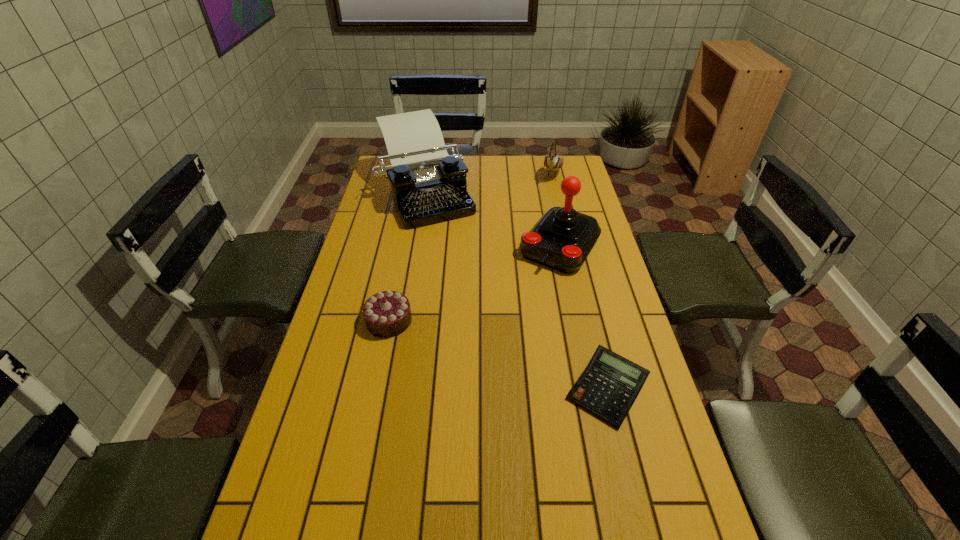
The width and height of the screenshot is (960, 540). What are the coordinates of `vacant position located 0.350m on the keys of the typewriter` in the screenshot? It's located at (474, 287).

The width and height of the screenshot is (960, 540). I want to click on vacant space located 0.170m on the keys of the typewriter, so click(x=456, y=254).

Find the location of `vacant space located at the face of the third tallest object`. vacant space located at the face of the third tallest object is located at coordinates (542, 220).

At what (x,y) coordinates should I click in order to perform the action: click on vacant space located 0.160m at the face of the third tallest object. Please return your answer as a coordinate pair (x, y). Image resolution: width=960 pixels, height=540 pixels. Looking at the image, I should click on (545, 208).

The height and width of the screenshot is (540, 960). Identify the location of vacant space located at the face of the third tallest object. (540, 227).

This screenshot has width=960, height=540. I want to click on vacant space situated 0.240m on the base of the joystick, so click(x=510, y=318).

The image size is (960, 540). What are the coordinates of `blank space located 0.150m on the base of the joystick` in the screenshot? It's located at (523, 299).

Locate an element on the screen. This screenshot has width=960, height=540. vacant space located 0.370m on the base of the joystick is located at coordinates (489, 347).

What are the coordinates of `typewriter at the far edge` in the screenshot? It's located at (429, 186).

Image resolution: width=960 pixels, height=540 pixels. I want to click on bird present at the far edge, so click(x=552, y=162).